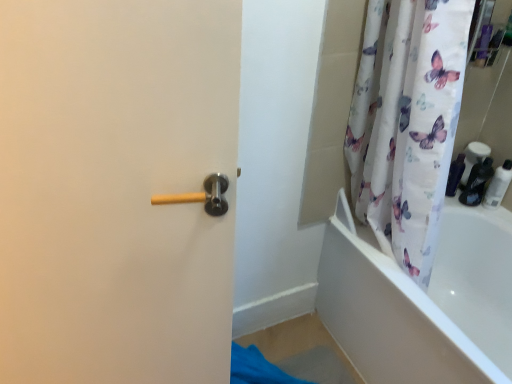
Question: From the image's perspective, is matte black toiletries at right, which is counted as the second toiletry, starting from the right, beneath white glossy bottle at right, placed as the 3th toiletry when sorted from left to right?

Choices:
 (A) yes
 (B) no

Answer: (B)

Question: Is the depth of matte black toiletries at right, which is counted as the second toiletry, starting from the right, less than that of white glossy bottle at right, the 1th toiletry positioned from the right?

Choices:
 (A) no
 (B) yes

Answer: (A)

Question: From a real-world perspective, is matte black toiletries at right, which is counted as the second toiletry, starting from the right, beneath white glossy bottle at right, the 1th toiletry positioned from the right?

Choices:
 (A) no
 (B) yes

Answer: (B)

Question: From the image's perspective, is matte black toiletries at right, the second toiletry viewed from the left, on top of white glossy bottle at right, placed as the 3th toiletry when sorted from left to right?

Choices:
 (A) no
 (B) yes

Answer: (B)

Question: Is matte black toiletries at right, the second toiletry viewed from the left, to the left of white glossy bottle at right, placed as the 3th toiletry when sorted from left to right, from the viewer's perspective?

Choices:
 (A) yes
 (B) no

Answer: (A)

Question: Based on their sizes in the image, would you say matte black toiletries at right, which is counted as the second toiletry, starting from the right, is bigger or smaller than matte black bottle at right, which appears as the 1th toiletry when viewed from the left?

Choices:
 (A) big
 (B) small

Answer: (A)

Question: Is matte black toiletries at right, which is counted as the second toiletry, starting from the right, taller or shorter than matte black bottle at right, the 3th toiletry when ordered from right to left?

Choices:
 (A) short
 (B) tall

Answer: (B)

Question: From the image's perspective, is matte black toiletries at right, the second toiletry viewed from the left, located above or below matte black bottle at right, which appears as the 1th toiletry when viewed from the left?

Choices:
 (A) below
 (B) above

Answer: (A)

Question: Is matte black toiletries at right, the second toiletry viewed from the left, to the left or to the right of matte black bottle at right, the 3th toiletry when ordered from right to left, in the image?

Choices:
 (A) left
 (B) right

Answer: (B)

Question: From the image's perspective, is matte black bottle at right, the 3th toiletry when ordered from right to left, above or below matte black toiletries at right, the second toiletry viewed from the left?

Choices:
 (A) below
 (B) above

Answer: (B)

Question: In terms of width, does matte black bottle at right, the 3th toiletry when ordered from right to left, look wider or thinner when compared to matte black toiletries at right, the second toiletry viewed from the left?

Choices:
 (A) thin
 (B) wide

Answer: (A)

Question: Is matte black bottle at right, which appears as the 1th toiletry when viewed from the left, taller or shorter than matte black toiletries at right, which is counted as the second toiletry, starting from the right?

Choices:
 (A) tall
 (B) short

Answer: (B)

Question: Is point (454, 175) closer or farther from the camera than point (477, 190)?

Choices:
 (A) closer
 (B) farther

Answer: (B)

Question: In terms of height, does matte black bottle at right, the 3th toiletry when ordered from right to left, look taller or shorter compared to white glossy bottle at right, the 1th toiletry positioned from the right?

Choices:
 (A) short
 (B) tall

Answer: (A)

Question: From a real-world perspective, relative to white glossy bottle at right, placed as the 3th toiletry when sorted from left to right, is matte black bottle at right, the 3th toiletry when ordered from right to left, vertically above or below?

Choices:
 (A) above
 (B) below

Answer: (B)